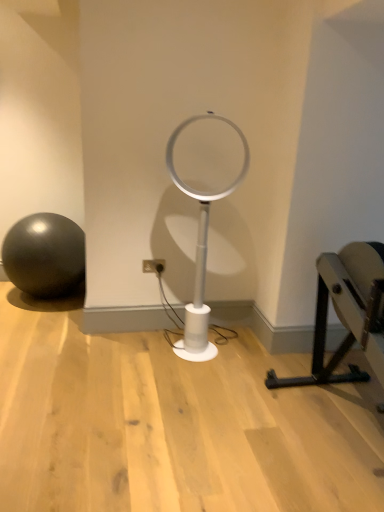
Question: Is matte black ball at left far away from white plastic table lamp at center?

Choices:
 (A) no
 (B) yes

Answer: (B)

Question: Is matte black ball at left oriented away from white plastic table lamp at center?

Choices:
 (A) yes
 (B) no

Answer: (B)

Question: From the image's perspective, is matte black ball at left over white plastic table lamp at center?

Choices:
 (A) no
 (B) yes

Answer: (A)

Question: Is matte black ball at left with white plastic table lamp at center?

Choices:
 (A) yes
 (B) no

Answer: (B)

Question: Considering the relative sizes of matte black ball at left and white plastic table lamp at center in the image provided, is matte black ball at left wider than white plastic table lamp at center?

Choices:
 (A) no
 (B) yes

Answer: (B)

Question: Does matte black ball at left have a lesser height compared to white plastic table lamp at center?

Choices:
 (A) yes
 (B) no

Answer: (A)

Question: Does matte black ball at left come in front of black metal bench at right?

Choices:
 (A) yes
 (B) no

Answer: (B)

Question: Is matte black ball at left positioned with its back to black metal bench at right?

Choices:
 (A) no
 (B) yes

Answer: (A)

Question: From a real-world perspective, does matte black ball at left sit lower than black metal bench at right?

Choices:
 (A) yes
 (B) no

Answer: (A)

Question: Is matte black ball at left with black metal bench at right?

Choices:
 (A) no
 (B) yes

Answer: (A)

Question: Does matte black ball at left have a lesser height compared to black metal bench at right?

Choices:
 (A) yes
 (B) no

Answer: (A)

Question: From the image's perspective, is matte black ball at left located above black metal bench at right?

Choices:
 (A) yes
 (B) no

Answer: (A)

Question: Is white plastic electric outlet at center at the back of white plastic table lamp at center?

Choices:
 (A) yes
 (B) no

Answer: (B)